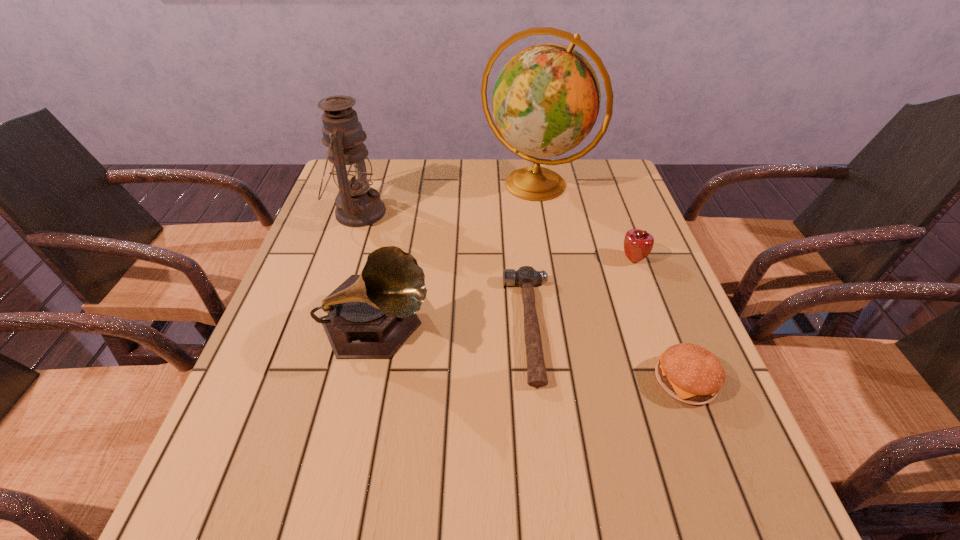
Locate an element on the screen. The image size is (960, 540). vacant position located on the left of the apple is located at coordinates (474, 260).

Find the location of a particular element. This screenshot has width=960, height=540. blank area located 0.090m on the left of the hamburger is located at coordinates [609, 381].

This screenshot has width=960, height=540. I want to click on free space located 0.090m on the striking face of the hammer, so click(x=464, y=327).

This screenshot has height=540, width=960. Identify the location of vacant space located on the striking face of the hammer. (386, 327).

The width and height of the screenshot is (960, 540). Find the location of `vacant region located on the striking face of the hammer`. vacant region located on the striking face of the hammer is located at coordinates (409, 327).

Locate an element on the screen. This screenshot has height=540, width=960. globe located in the far edge section of the desktop is located at coordinates (546, 99).

Identify the location of oil lamp present at the far edge. This screenshot has width=960, height=540. (357, 205).

Identify the location of oil lamp that is at the left edge. (357, 205).

At what (x,y) coordinates should I click in order to perform the action: click on phonograph record positioned at the left edge. Please return your answer as a coordinate pair (x, y). Looking at the image, I should click on (370, 316).

Locate an element on the screen. This screenshot has width=960, height=540. globe at the right edge is located at coordinates (546, 99).